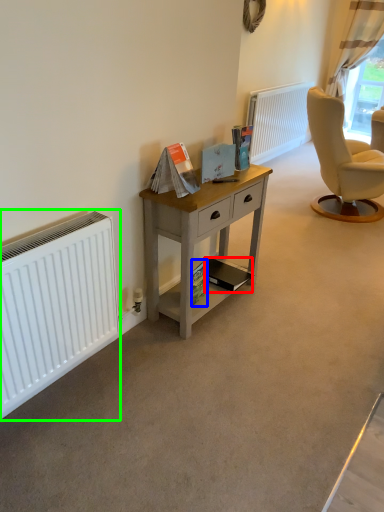
Question: Which is nearer to the magazine (highlighted by a red box)? magazine (highlighted by a blue box) or radiator (highlighted by a green box).

Choices:
 (A) magazine
 (B) radiator

Answer: (A)